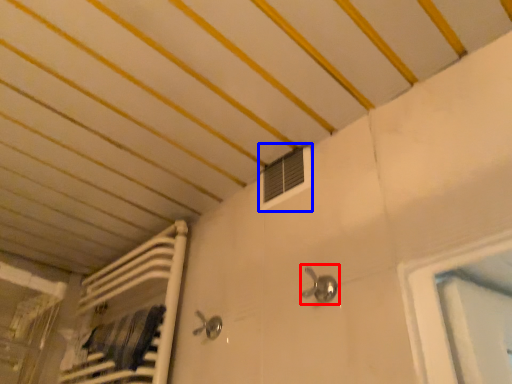
Question: Among these objects, which one is farthest to the camera, faucet (highlighted by a red box) or air conditioning (highlighted by a blue box)?

Choices:
 (A) faucet
 (B) air conditioning

Answer: (B)